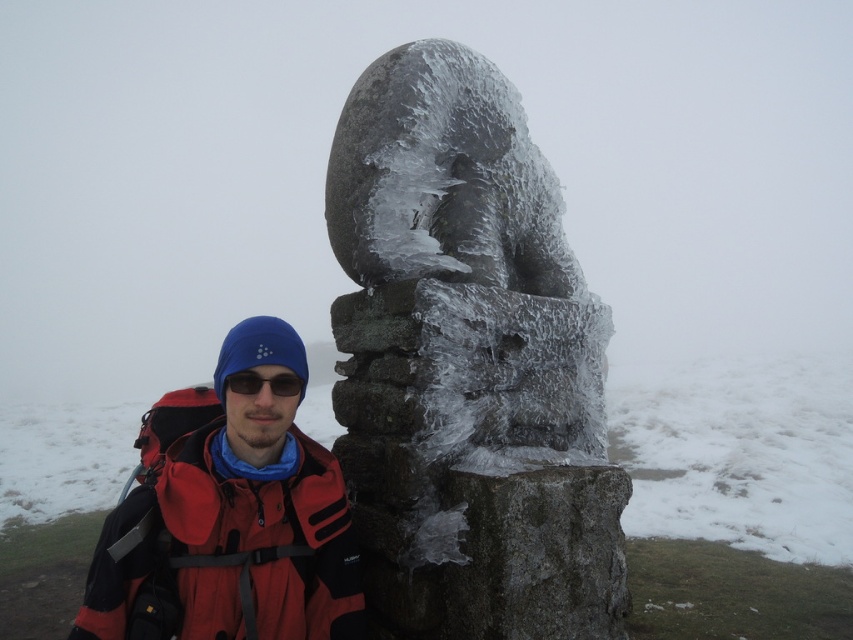
Question: Does icy stone sculpture at center appear over white frosty snow at center?

Choices:
 (A) yes
 (B) no

Answer: (A)

Question: Where is icy stone sculpture at center located in relation to white frosty snow at center in the image?

Choices:
 (A) left
 (B) right

Answer: (B)

Question: Which object is closer to the camera taking this photo?

Choices:
 (A) white frosty snow at center
 (B) red matte jacket at lower left
 (C) icy stone sculpture at center

Answer: (B)

Question: Is red matte jacket at lower left positioned at the back of black plastic goggles at center?

Choices:
 (A) no
 (B) yes

Answer: (A)

Question: Which object is the farthest from the white frosty snow at center?

Choices:
 (A) icy stone sculpture at center
 (B) black plastic goggles at center
 (C) red matte jacket at lower left

Answer: (C)

Question: Which of the following is the closest to the observer?

Choices:
 (A) icy stone sculpture at center
 (B) red matte jacket at lower left
 (C) white frosty snow at center

Answer: (B)